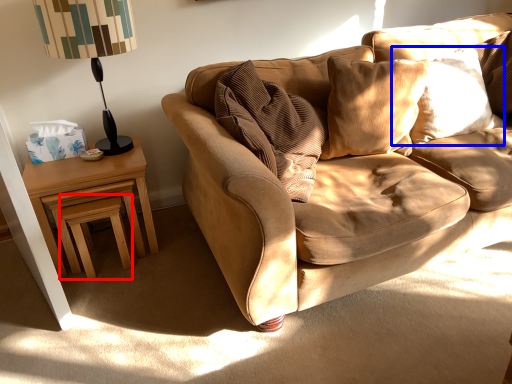
Question: Which of the following is the closest to the observer, stool (highlighted by a red box) or pillow (highlighted by a blue box)?

Choices:
 (A) stool
 (B) pillow

Answer: (A)